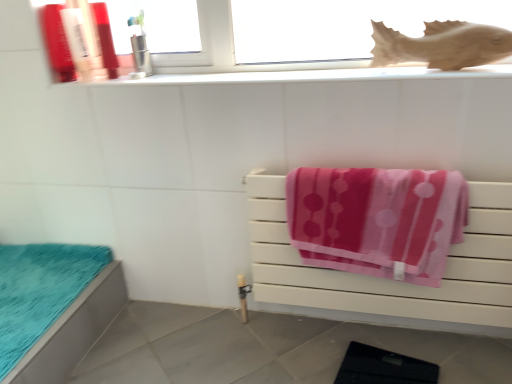
Where is `free spot in front of metallic toothbrush holder at upper left, arranged as the 4th toiletry when viewed from the left`? free spot in front of metallic toothbrush holder at upper left, arranged as the 4th toiletry when viewed from the left is located at coordinates (147, 77).